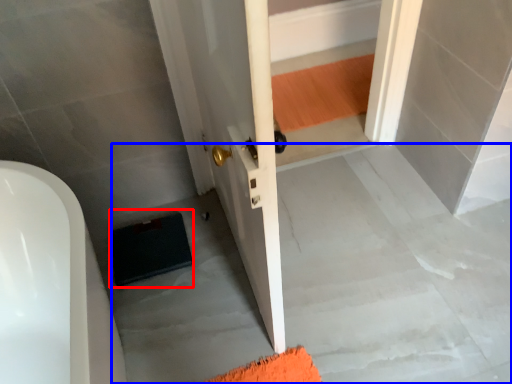
Question: Which point is closer to the camera, doormat (highlighted by a red box) or concrete (highlighted by a blue box)?

Choices:
 (A) doormat
 (B) concrete

Answer: (B)